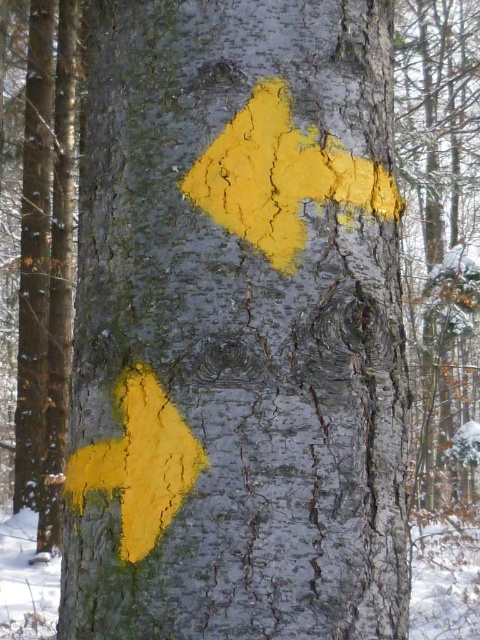
Is yellow matte arrow at center in front of yellow matte arrow at lower left?

No, it is not.

Who is higher up, yellow matte arrow at center or yellow matte arrow at lower left?

yellow matte arrow at center

Which is behind, point (242, 152) or point (162, 499)?

The point (242, 152) is more distant.

I want to click on yellow matte arrow at center, so click(x=280, y=177).